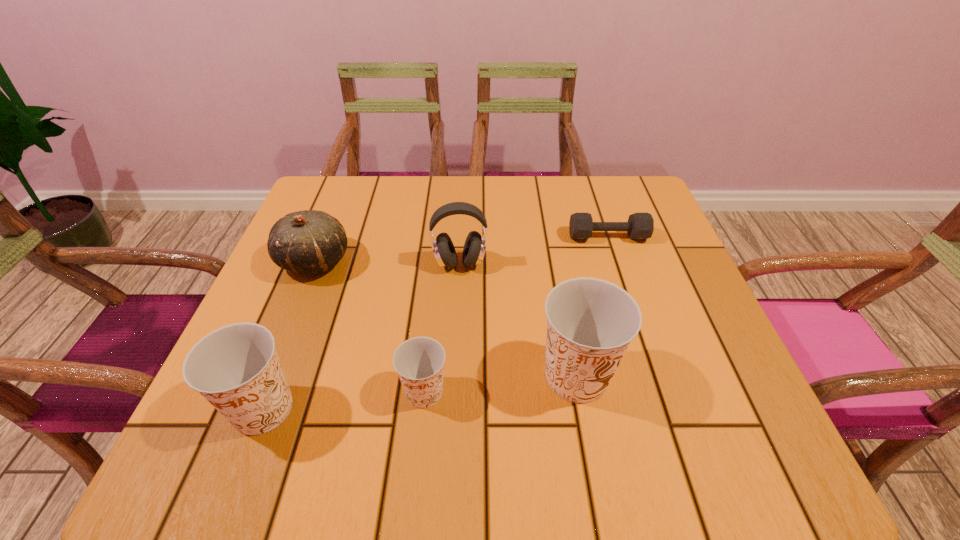
Please point a free position for a Dixie cup on the right. Please provide its 2D coordinates. Your answer should be formatted as a tuple, i.e. [(x, y)], where the tuple contains the x and y coordinates of a point satisfying the conditions above.

[(719, 361)]